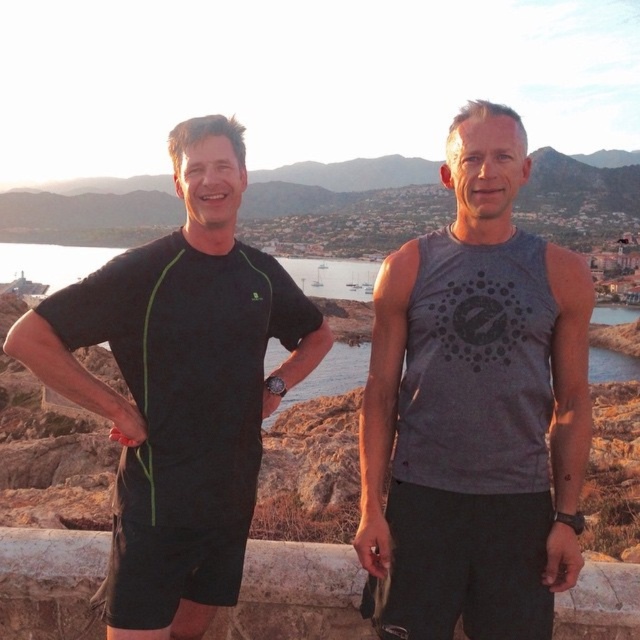
You are taking a photo of the scene and want to focus on the gray matte tank top at center. According to the coordinates provided, where should you aim your camera to ensure it captures the tank top precisely?

The gray matte tank top at center is located at point coordinates (476, 406), so you should aim your camera at those coordinates to capture it precisely.

You are standing at the point marked by the coordinates point at (x=220, y=342). You want to throw a ball to the other person who is 135.69 feet away. Is the distance within a typical adult male baseball player average throwing distance of 150 feet?

The distance between you and the other person is 135.69 feet, which is within the typical adult male baseball player average throwing distance of 150 feet. The ball can be thrown successfully.